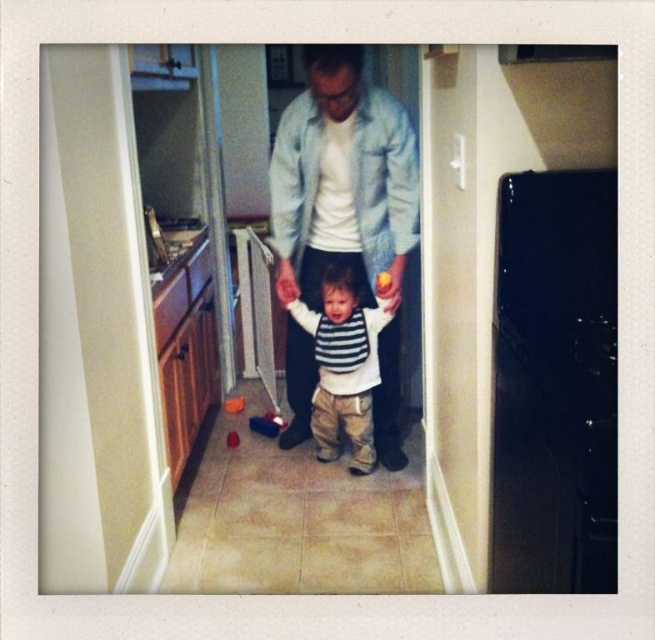
Is denim jacket at center to the left of striped cotton shirt at center from the viewer's perspective?

Incorrect, denim jacket at center is not on the left side of striped cotton shirt at center.

Measure the distance between denim jacket at center and camera.

1.90 meters

This screenshot has width=655, height=640. Find the location of `denim jacket at center`. denim jacket at center is located at coordinates (343, 179).

Locate an element on the screen. denim jacket at center is located at coordinates (343, 179).